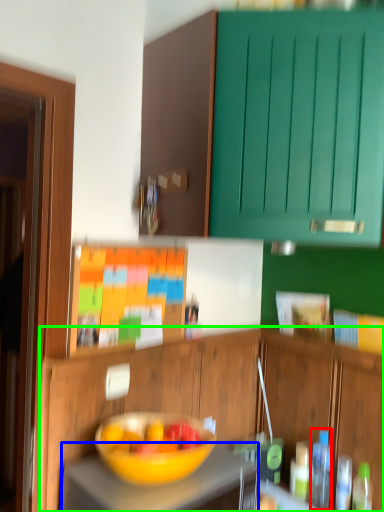
Question: Which object is positioned farthest from bottle (highlighted by a red box)? Select from desk (highlighted by a blue box) and cabinetry (highlighted by a green box).

Choices:
 (A) desk
 (B) cabinetry

Answer: (A)